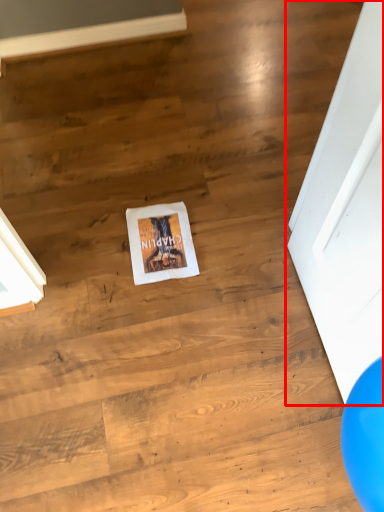
Question: Considering the relative positions of door (annotated by the red box) and flyer in the image provided, where is door (annotated by the red box) located with respect to the staircase?

Choices:
 (A) right
 (B) left

Answer: (A)